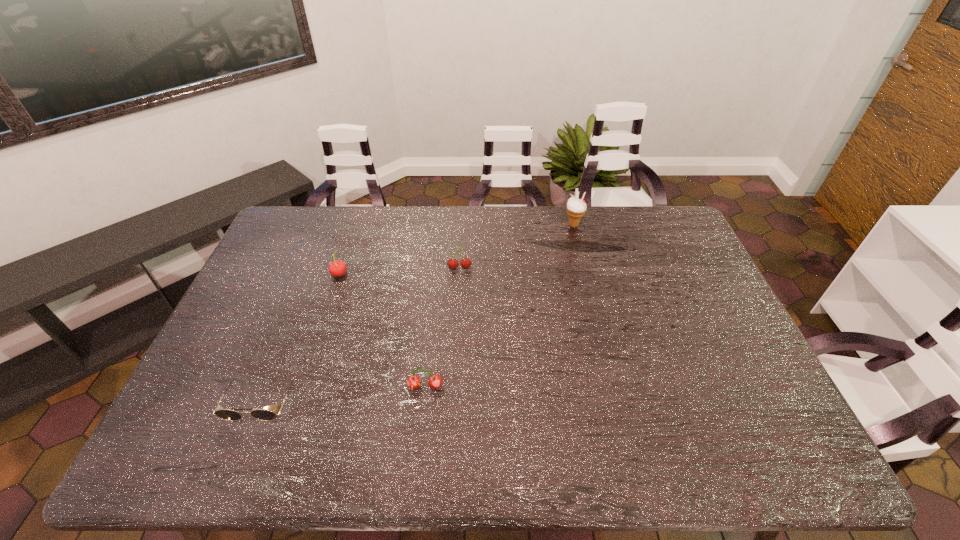
Image resolution: width=960 pixels, height=540 pixels. Find the location of `the rightmost object`. the rightmost object is located at coordinates (576, 208).

Locate an element on the screen. icecream is located at coordinates (576, 208).

This screenshot has height=540, width=960. I want to click on the leftmost cherry, so click(x=337, y=268).

This screenshot has width=960, height=540. I want to click on the nearest cherry, so click(435, 381).

You are a GUI agent. You are given a task and a screenshot of the screen. Output one action in this format:
    pyautogui.click(x=<x>, y=<y>)
    Task: Click on the sunglasses
    
    Given the screenshot: What is the action you would take?
    pyautogui.click(x=261, y=414)

This screenshot has height=540, width=960. I want to click on free location located on the front of the rightmost object, so click(587, 277).

Where is `vacant space situated on the left of the leftmost cherry`? The image size is (960, 540). vacant space situated on the left of the leftmost cherry is located at coordinates (276, 274).

Image resolution: width=960 pixels, height=540 pixels. Identify the location of vacant area located 0.170m with stems pointing upwards on the nearest cherry. (418, 459).

Image resolution: width=960 pixels, height=540 pixels. I want to click on object at the far edge, so click(576, 208).

Where is `object that is at the left edge`? The image size is (960, 540). object that is at the left edge is located at coordinates (261, 414).